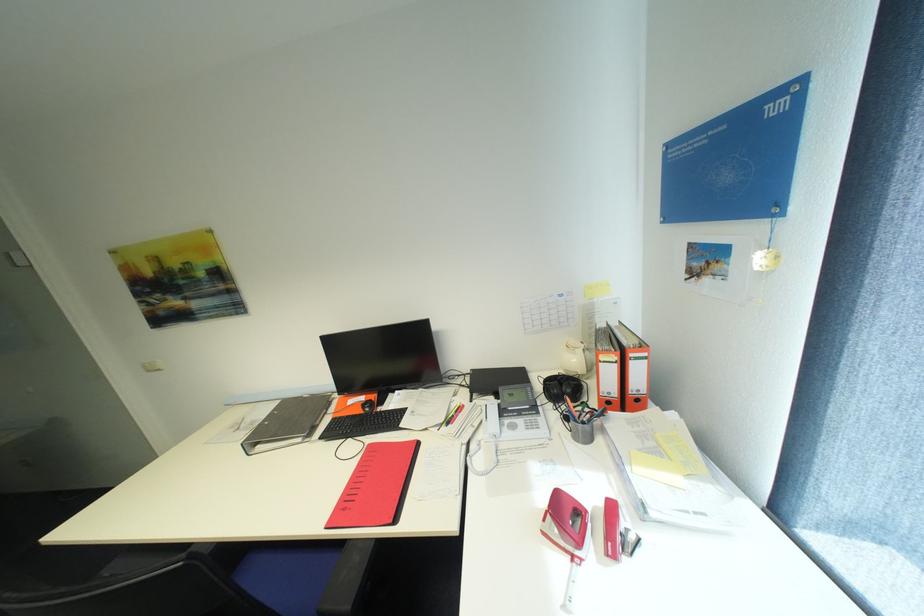
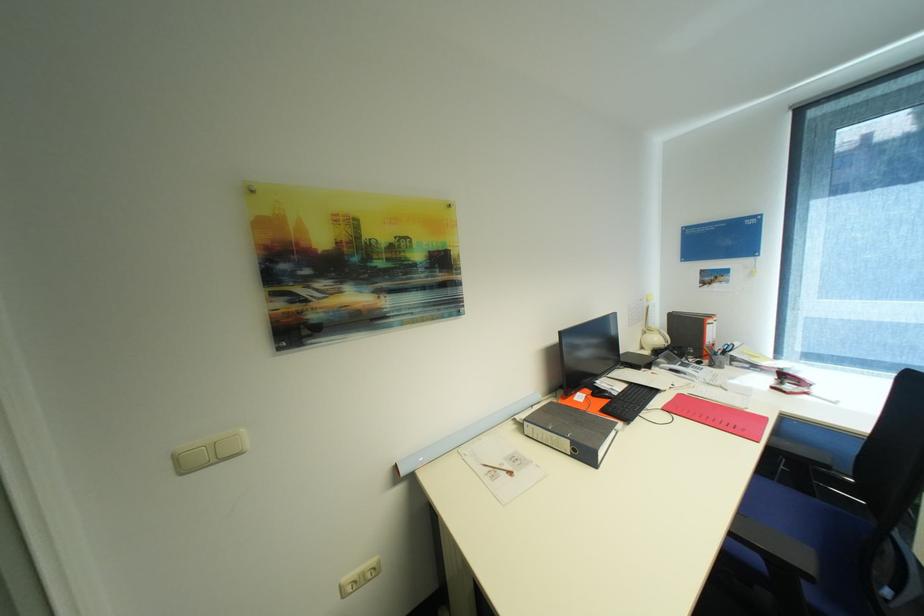
In the second image, find the point that corresponds to the point at 580,557 in the first image.

(813, 394)